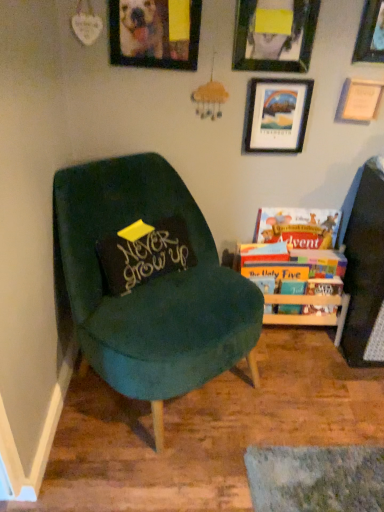
Image resolution: width=384 pixels, height=512 pixels. I want to click on hardcover book at right, which is the 1th book in top-to-bottom order, so click(298, 227).

The width and height of the screenshot is (384, 512). Describe the element at coordinates (298, 227) in the screenshot. I see `hardcover book at right, which is the 1th book in top-to-bottom order` at that location.

This screenshot has height=512, width=384. What do you see at coordinates (277, 115) in the screenshot?
I see `wooden picture frame at upper right, positioned as the 3th picture frame in right-to-left order` at bounding box center [277, 115].

How much space does matte black picture frame at upper center, placed as the second picture frame when sorted from left to right, occupy vertically?

matte black picture frame at upper center, placed as the second picture frame when sorted from left to right, is 13.39 inches tall.

Find the location of `wooden picture frame at upper right, the second picture frame positioned from the right`. wooden picture frame at upper right, the second picture frame positioned from the right is located at coordinates (358, 101).

In order to face velvet green chair at left, should I rotate leftwards or rightwards?

Turn left approximately 3.947 degrees to face it.

Image resolution: width=384 pixels, height=512 pixels. What do you see at coordinates (296, 249) in the screenshot? I see `hardcover books at right, which is the first book from bottom to top` at bounding box center [296, 249].

Locate an element on the screen. This screenshot has width=384, height=512. hardcover books at right, which is the first book from bottom to top is located at coordinates (296, 249).

You are a GUI agent. You are given a task and a screenshot of the screen. Output one action in this format:
    pyautogui.click(x=<x>, y=<y>)
    Task: Click on the wooden picture frame at upper right, placed as the 1th picture frame when sorted from right to left
    
    Given the screenshot: What is the action you would take?
    pyautogui.click(x=370, y=34)

The width and height of the screenshot is (384, 512). Identify the location of hardcover book at right, the 2th book from the bottom. (298, 227).

Is black velvet pillow at center at the right side of wooden picture frame at upper right, the 4th picture frame viewed from the left?

Incorrect, black velvet pillow at center is not on the right side of wooden picture frame at upper right, the 4th picture frame viewed from the left.

From a real-world perspective, is black velvet pillow at center physically below wooden picture frame at upper right, the 4th picture frame viewed from the left?

Yes.

Who is shorter, black velvet pillow at center or wooden picture frame at upper right, the second picture frame positioned from the right?

With less height is wooden picture frame at upper right, the second picture frame positioned from the right.

Is the depth of black velvet pillow at center greater than that of wooden picture frame at upper right, the second picture frame positioned from the right?

No.

Can you confirm if velvet green chair at left is bigger than matte black picture frame at upper center, arranged as the 4th picture frame when viewed from the right?

Indeed, velvet green chair at left has a larger size compared to matte black picture frame at upper center, arranged as the 4th picture frame when viewed from the right.

Based on the photo, would you consider velvet green chair at left to be distant from matte black picture frame at upper center, arranged as the 4th picture frame when viewed from the right?

Actually, velvet green chair at left and matte black picture frame at upper center, arranged as the 4th picture frame when viewed from the right, are a little close together.

Is matte black picture frame at upper center, placed as the second picture frame when sorted from left to right, inside velvet green chair at left?

No, matte black picture frame at upper center, placed as the second picture frame when sorted from left to right, is not surrounded by velvet green chair at left.

Which of these two, velvet green chair at left or matte black picture frame at upper center, placed as the second picture frame when sorted from left to right, stands taller?

velvet green chair at left is taller.

Is wooden picture frame at upper right, placed as the 1th picture frame when sorted from right to left, situated inside wooden picture frame at upper center, placed as the 5th picture frame when sorted from right to left, or outside?

wooden picture frame at upper right, placed as the 1th picture frame when sorted from right to left, lies outside wooden picture frame at upper center, placed as the 5th picture frame when sorted from right to left.

Does wooden picture frame at upper right, marked as the 5th picture frame in a left-to-right arrangement, touch wooden picture frame at upper center, placed as the 5th picture frame when sorted from right to left?

No, wooden picture frame at upper right, marked as the 5th picture frame in a left-to-right arrangement, is not beside wooden picture frame at upper center, placed as the 5th picture frame when sorted from right to left.

From a real-world perspective, is wooden picture frame at upper right, marked as the 5th picture frame in a left-to-right arrangement, positioned under wooden picture frame at upper center, which is the first picture frame in left-to-right order, based on gravity?

Actually, wooden picture frame at upper right, marked as the 5th picture frame in a left-to-right arrangement, is physically above wooden picture frame at upper center, which is the first picture frame in left-to-right order, in the real world.

Find the location of a particular element. the 2nd picture frame in front when counting from the wooden picture frame at upper right, placed as the 1th picture frame when sorted from right to left is located at coordinates (155, 33).

Is hardcover books at right, which is the first book from bottom to top, far from velvet green chair at left?

No, there isn't a large distance between hardcover books at right, which is the first book from bottom to top, and velvet green chair at left.

Which is farther from the camera, (268, 232) or (118, 332)?

The point (268, 232) is farther from the camera.

Between hardcover books at right, placed as the 2th book when sorted from top to bottom, and velvet green chair at left, which one has smaller size?

With smaller size is hardcover books at right, placed as the 2th book when sorted from top to bottom.

Is matte black picture frame at upper center, arranged as the 4th picture frame when viewed from the right, behind wooden picture frame at upper center, which is the first picture frame in left-to-right order?

Yes, matte black picture frame at upper center, arranged as the 4th picture frame when viewed from the right, is further from the viewer.

Is wooden picture frame at upper center, which is the first picture frame in left-to-right order, a part of matte black picture frame at upper center, arranged as the 4th picture frame when viewed from the right?

No.

From the image's perspective, is matte black picture frame at upper center, arranged as the 4th picture frame when viewed from the right, over wooden picture frame at upper center, which is the first picture frame in left-to-right order?

Indeed, from the image's perspective, matte black picture frame at upper center, arranged as the 4th picture frame when viewed from the right, is shown above wooden picture frame at upper center, which is the first picture frame in left-to-right order.

Is matte black picture frame at upper center, placed as the second picture frame when sorted from left to right, thinner than wooden picture frame at upper center, which is the first picture frame in left-to-right order?

Correct, the width of matte black picture frame at upper center, placed as the second picture frame when sorted from left to right, is less than that of wooden picture frame at upper center, which is the first picture frame in left-to-right order.

Considering the positions of objects wooden picture frame at upper right, the 3th picture frame viewed from the left, and velvet green chair at left in the image provided, who is in front, wooden picture frame at upper right, the 3th picture frame viewed from the left, or velvet green chair at left?

velvet green chair at left.

Does point (249, 117) lie behind point (132, 312)?

That is True.

Who is smaller, wooden picture frame at upper right, positioned as the 3th picture frame in right-to-left order, or velvet green chair at left?

With smaller size is wooden picture frame at upper right, positioned as the 3th picture frame in right-to-left order.

From a real-world perspective, is wooden picture frame at upper right, positioned as the 3th picture frame in right-to-left order, above or below velvet green chair at left?

wooden picture frame at upper right, positioned as the 3th picture frame in right-to-left order, is above velvet green chair at left.

Is matte black picture frame at upper center, arranged as the 4th picture frame when viewed from the right, next to black velvet pillow at center?

matte black picture frame at upper center, arranged as the 4th picture frame when viewed from the right, and black velvet pillow at center are not in contact.

How distant is matte black picture frame at upper center, placed as the second picture frame when sorted from left to right, from black velvet pillow at center?

30.60 inches.

From the image's perspective, is matte black picture frame at upper center, arranged as the 4th picture frame when viewed from the right, positioned above or below black velvet pillow at center?

matte black picture frame at upper center, arranged as the 4th picture frame when viewed from the right, is above black velvet pillow at center.

Is matte black picture frame at upper center, arranged as the 4th picture frame when viewed from the right, facing away from black velvet pillow at center?

matte black picture frame at upper center, arranged as the 4th picture frame when viewed from the right, does not have its back to black velvet pillow at center.

Where is `pillow below the wooden picture frame at upper right, the 4th picture frame viewed from the left (from the image's perspective)`? pillow below the wooden picture frame at upper right, the 4th picture frame viewed from the left (from the image's perspective) is located at coordinates (144, 254).

Locate an element on the screen. This screenshot has width=384, height=512. chair below the matte black picture frame at upper center, placed as the second picture frame when sorted from left to right (from a real-world perspective) is located at coordinates (150, 286).

When comparing their distances from velvet green chair at left, does wooden picture frame at upper right, positioned as the 3th picture frame in right-to-left order, or wooden picture frame at upper right, the second picture frame positioned from the right, seem further?

wooden picture frame at upper right, the second picture frame positioned from the right, lies further to velvet green chair at left than the other object.

Based on their spatial positions, is wooden picture frame at upper right, placed as the 1th picture frame when sorted from right to left, or wooden picture frame at upper right, the 4th picture frame viewed from the left, further from velvet green chair at left?

The object further to velvet green chair at left is wooden picture frame at upper right, placed as the 1th picture frame when sorted from right to left.

From the image, which object appears to be nearer to black velvet pillow at center, matte black picture frame at upper center, placed as the second picture frame when sorted from left to right, or wooden picture frame at upper right, marked as the 5th picture frame in a left-to-right arrangement?

A: matte black picture frame at upper center, placed as the second picture frame when sorted from left to right.

Which object lies nearer to the anchor point wooden picture frame at upper right, the 4th picture frame viewed from the left, wooden picture frame at upper center, which is the first picture frame in left-to-right order, or black velvet pillow at center?

Among the two, wooden picture frame at upper center, which is the first picture frame in left-to-right order, is located nearer to wooden picture frame at upper right, the 4th picture frame viewed from the left.

Looking at the image, which one is located further to hardcover book at right, the 2th book from the bottom, wooden picture frame at upper right, marked as the 5th picture frame in a left-to-right arrangement, or wooden picture frame at upper right, the 4th picture frame viewed from the left?

Among the two, wooden picture frame at upper right, marked as the 5th picture frame in a left-to-right arrangement, is located further to hardcover book at right, the 2th book from the bottom.

From the picture: From the image, which object appears to be farther from wooden picture frame at upper right, placed as the 1th picture frame when sorted from right to left, matte black picture frame at upper center, placed as the second picture frame when sorted from left to right, or wooden picture frame at upper right, the 3th picture frame viewed from the left?

Based on the image, wooden picture frame at upper right, the 3th picture frame viewed from the left, appears to be further to wooden picture frame at upper right, placed as the 1th picture frame when sorted from right to left.

Considering their positions, is matte black picture frame at upper center, placed as the second picture frame when sorted from left to right, positioned closer to wooden picture frame at upper right, the 4th picture frame viewed from the left, than black velvet pillow at center?

matte black picture frame at upper center, placed as the second picture frame when sorted from left to right, lies closer to wooden picture frame at upper right, the 4th picture frame viewed from the left, than the other object.

Which object lies further to the anchor point hardcover books at right, placed as the 2th book when sorted from top to bottom, wooden picture frame at upper right, positioned as the 3th picture frame in right-to-left order, or velvet green chair at left?

Among the two, velvet green chair at left is located further to hardcover books at right, placed as the 2th book when sorted from top to bottom.

Where is `pillow between wooden picture frame at upper right, placed as the 1th picture frame when sorted from right to left, and hardcover books at right, which is the first book from bottom to top, vertically`? This screenshot has height=512, width=384. pillow between wooden picture frame at upper right, placed as the 1th picture frame when sorted from right to left, and hardcover books at right, which is the first book from bottom to top, vertically is located at coordinates (144, 254).

Image resolution: width=384 pixels, height=512 pixels. I want to click on chair between wooden picture frame at upper right, marked as the 5th picture frame in a left-to-right arrangement, and hardcover books at right, which is the first book from bottom to top, from top to bottom, so click(x=150, y=286).

The width and height of the screenshot is (384, 512). Find the location of `pillow that lies between wooden picture frame at upper center, which is the first picture frame in left-to-right order, and hardcover books at right, placed as the 2th book when sorted from top to bottom, from top to bottom`. pillow that lies between wooden picture frame at upper center, which is the first picture frame in left-to-right order, and hardcover books at right, placed as the 2th book when sorted from top to bottom, from top to bottom is located at coordinates (144, 254).

Where is `pillow between wooden picture frame at upper center, which is the first picture frame in left-to-right order, and velvet green chair at left in the up-down direction`? The image size is (384, 512). pillow between wooden picture frame at upper center, which is the first picture frame in left-to-right order, and velvet green chair at left in the up-down direction is located at coordinates click(144, 254).